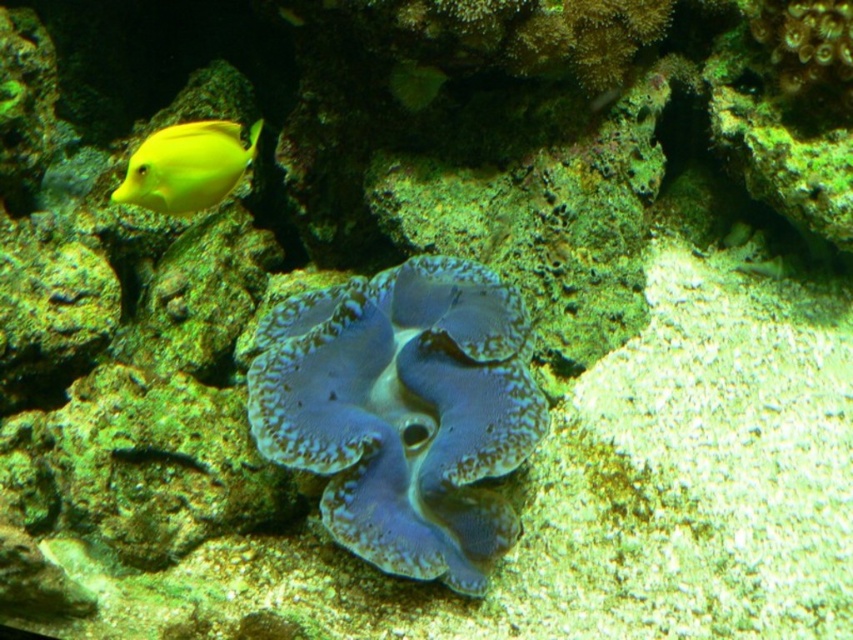
Does blue textured clam at center appear on the right side of yellow matte fish at upper left?

Correct, you'll find blue textured clam at center to the right of yellow matte fish at upper left.

Find the location of `blue textured clam at center`. blue textured clam at center is located at coordinates (403, 412).

This screenshot has width=853, height=640. I want to click on blue textured clam at center, so click(x=403, y=412).